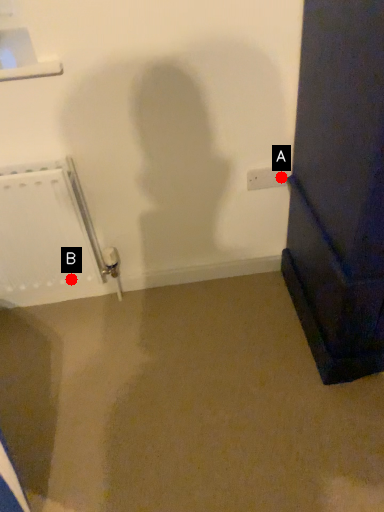
Question: Two points are circled on the image, labeled by A and B beside each circle. Which point is closer to the camera taking this photo?

Choices:
 (A) A is closer
 (B) B is closer

Answer: (A)